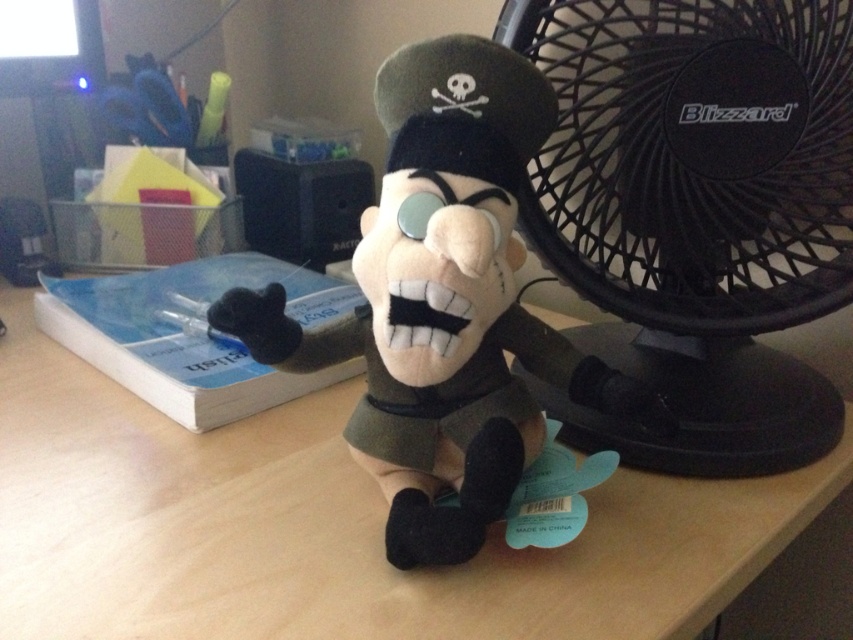
Question: Is wooden table at center in front of black plastic fan at right?

Choices:
 (A) yes
 (B) no

Answer: (A)

Question: Estimate the real-world distances between objects in this image. Which object is closer to the wooden table at center?

Choices:
 (A) black plastic fan at right
 (B) soft plush toy at center

Answer: (B)

Question: Is black plastic fan at right to the right of soft plush toy at center from the viewer's perspective?

Choices:
 (A) yes
 (B) no

Answer: (A)

Question: Among these objects, which one is farthest from the camera?

Choices:
 (A) black plastic fan at right
 (B) wooden table at center
 (C) soft plush toy at center

Answer: (A)

Question: Which of the following is the farthest from the observer?

Choices:
 (A) (480, 170)
 (B) (598, 224)
 (C) (361, 628)

Answer: (B)

Question: Does wooden table at center appear over soft plush toy at center?

Choices:
 (A) no
 (B) yes

Answer: (A)